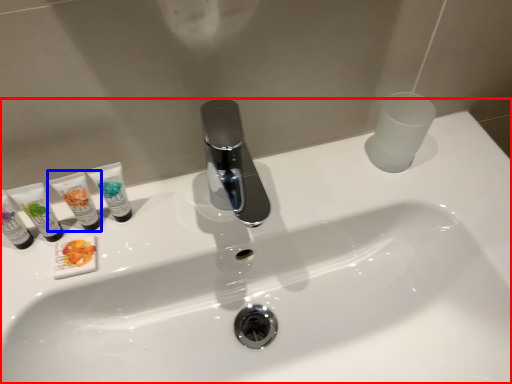
Question: Which object is further to the camera taking this photo, sink (highlighted by a red box) or toiletry (highlighted by a blue box)?

Choices:
 (A) sink
 (B) toiletry

Answer: (B)